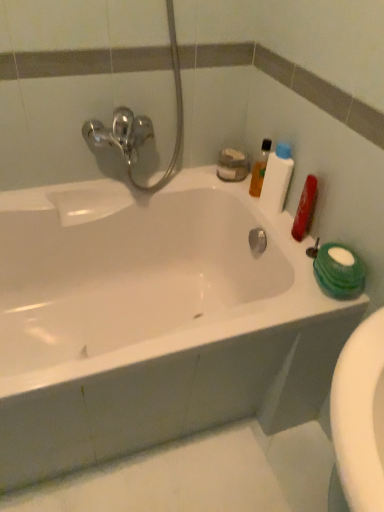
Question: From a real-world perspective, is white glossy bathtub at upper center positioned above or below translucent plastic bottle at upper right?

Choices:
 (A) below
 (B) above

Answer: (A)

Question: From the image's perspective, relative to translucent plastic bottle at upper right, is white glossy bathtub at upper center above or below?

Choices:
 (A) above
 (B) below

Answer: (B)

Question: Estimate the real-world distances between objects in this image. Which object is farther from the white glossy bathtub at upper center?

Choices:
 (A) translucent plastic bottle at upper right
 (B) translucent plastic bottle at upper right

Answer: (A)

Question: Estimate the real-world distances between objects in this image. Which object is farther from the translucent plastic bottle at upper right?

Choices:
 (A) translucent plastic bottle at upper right
 (B) white glossy bathtub at upper center

Answer: (B)